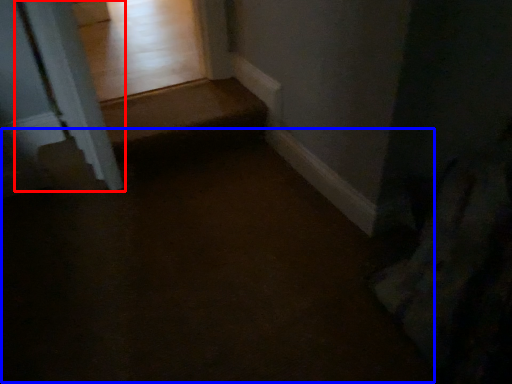
Question: Which of the following is the closest to the observer, pillar (highlighted by a red box) or path (highlighted by a blue box)?

Choices:
 (A) pillar
 (B) path

Answer: (B)